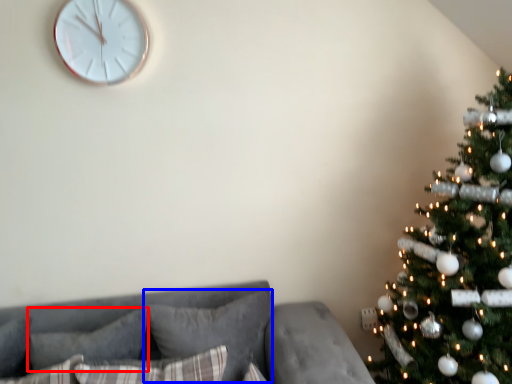
Question: Which point is closer to the camera, pillow (highlighted by a red box) or pillow (highlighted by a blue box)?

Choices:
 (A) pillow
 (B) pillow

Answer: (A)